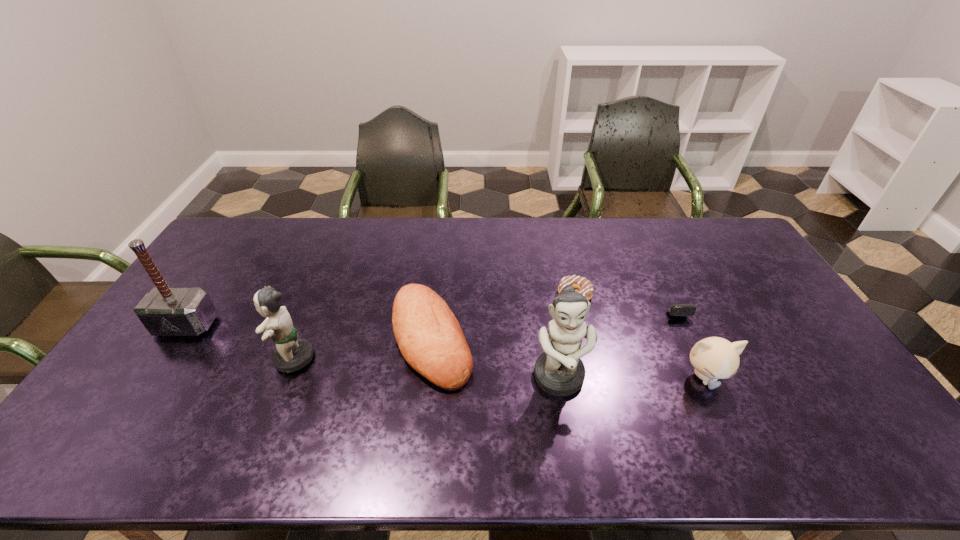
Observe the arrangement of all figurines in the image. To keep them evenly spaced, where would you place another figurine on the right? Please locate a free space. Please provide its 2D coordinates. Your answer should be formatted as a tuple, i.e. [(x, y)], where the tuple contains the x and y coordinates of a point satisfying the conditions above.

[(852, 402)]